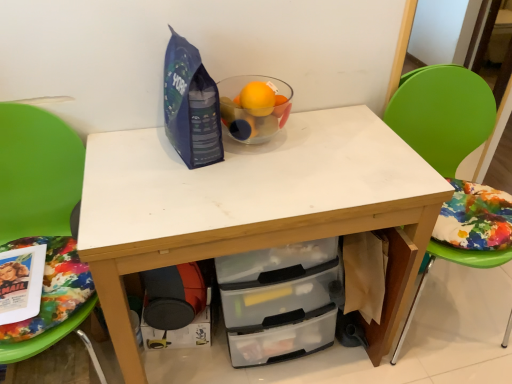
Question: Can we say green plastic chair at right, marked as the first chair in a right-to-left arrangement, lies outside green fabric chair at left, which is counted as the 2th chair, starting from the right?

Choices:
 (A) no
 (B) yes

Answer: (B)

Question: Is green plastic chair at right, marked as the first chair in a right-to-left arrangement, oriented towards green fabric chair at left, which is counted as the 2th chair, starting from the right?

Choices:
 (A) no
 (B) yes

Answer: (A)

Question: Can you confirm if green plastic chair at right, the 2th chair from the left, is shorter than green fabric chair at left, which is counted as the 2th chair, starting from the right?

Choices:
 (A) no
 (B) yes

Answer: (A)

Question: Is green plastic chair at right, the 2th chair from the left, next to green fabric chair at left, the first chair in the left-to-right sequence?

Choices:
 (A) no
 (B) yes

Answer: (A)

Question: From the image's perspective, does green plastic chair at right, the 2th chair from the left, appear lower than green fabric chair at left, the first chair in the left-to-right sequence?

Choices:
 (A) no
 (B) yes

Answer: (A)

Question: Is green fabric chair at left, the first chair in the left-to-right sequence, at the back of green plastic chair at right, marked as the first chair in a right-to-left arrangement?

Choices:
 (A) no
 (B) yes

Answer: (A)

Question: From the image's perspective, is green fabric chair at left, which is counted as the 2th chair, starting from the right, under black plastic drawer at lower center?

Choices:
 (A) yes
 (B) no

Answer: (B)

Question: Is green fabric chair at left, the first chair in the left-to-right sequence, looking in the opposite direction of black plastic drawer at lower center?

Choices:
 (A) yes
 (B) no

Answer: (B)

Question: From the image's perspective, would you say green fabric chair at left, the first chair in the left-to-right sequence, is positioned over black plastic drawer at lower center?

Choices:
 (A) no
 (B) yes

Answer: (B)

Question: Considering the relative sizes of green fabric chair at left, the first chair in the left-to-right sequence, and black plastic drawer at lower center in the image provided, is green fabric chair at left, the first chair in the left-to-right sequence, smaller than black plastic drawer at lower center?

Choices:
 (A) no
 (B) yes

Answer: (A)

Question: Is green fabric chair at left, which is counted as the 2th chair, starting from the right, oriented towards black plastic drawer at lower center?

Choices:
 (A) no
 (B) yes

Answer: (A)

Question: Considering the relative sizes of green fabric chair at left, which is counted as the 2th chair, starting from the right, and black plastic drawer at lower center in the image provided, is green fabric chair at left, which is counted as the 2th chair, starting from the right, shorter than black plastic drawer at lower center?

Choices:
 (A) no
 (B) yes

Answer: (A)

Question: From the image's perspective, does transparent glass bowl at center appear higher than black plastic drawer at lower center?

Choices:
 (A) no
 (B) yes

Answer: (B)